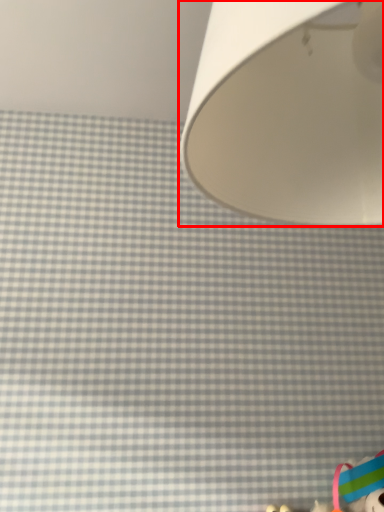
Question: From the image's perspective, what is the correct spatial positioning of lamp (annotated by the red box) in reference to toy?

Choices:
 (A) above
 (B) below

Answer: (A)